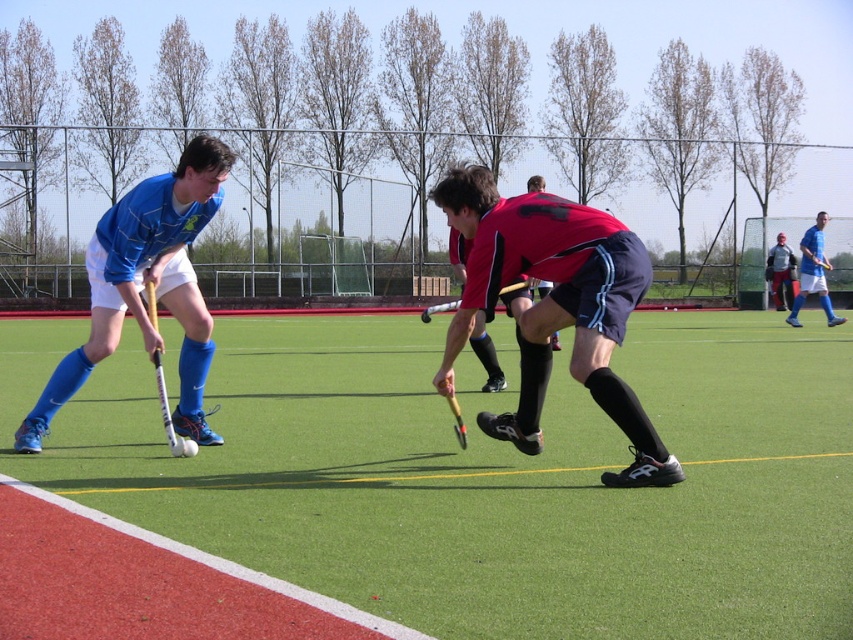
Who is higher up, green artificial turf at center or matte red shorts at center?

matte red shorts at center is above.

Which is more to the right, green artificial turf at center or matte red shorts at center?

Positioned to the right is matte red shorts at center.

Locate an element on the screen. The image size is (853, 640). green artificial turf at center is located at coordinates (485, 474).

Does matte blue jersey at left appear over wooden hockey stick at center?

Actually, matte blue jersey at left is below wooden hockey stick at center.

Identify the location of matte blue jersey at left. The image size is (853, 640). (144, 284).

At what (x,y) coordinates should I click in order to perform the action: click on matte blue jersey at left. Please return your answer as a coordinate pair (x, y). This screenshot has width=853, height=640. Looking at the image, I should click on (144, 284).

Is point (602, 212) closer to camera compared to point (152, 321)?

Yes, point (602, 212) is closer to viewer.

Which of these two, matte red shorts at center or white glossy hockey stick at left, stands shorter?

Standing shorter between the two is white glossy hockey stick at left.

Which is behind, point (496, 432) or point (154, 291)?

Positioned behind is point (496, 432).

I want to click on matte red shorts at center, so click(554, 307).